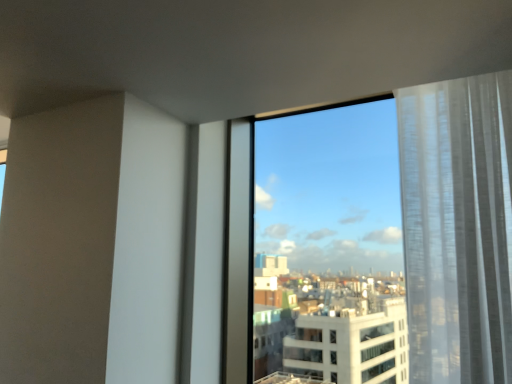
Question: From a real-world perspective, is white sheer curtain at right positioned above or below transparent glass window at center?

Choices:
 (A) above
 (B) below

Answer: (A)

Question: In terms of size, does white sheer curtain at right appear bigger or smaller than transparent glass window at center?

Choices:
 (A) small
 (B) big

Answer: (A)

Question: Is white sheer curtain at right in front of or behind transparent glass window at center in the image?

Choices:
 (A) behind
 (B) front

Answer: (B)

Question: Does point (488, 349) appear closer or farther from the camera than point (414, 134)?

Choices:
 (A) closer
 (B) farther

Answer: (A)

Question: From the image's perspective, is transparent glass window at center positioned above or below white sheer curtain at right?

Choices:
 (A) below
 (B) above

Answer: (A)

Question: In terms of height, does transparent glass window at center look taller or shorter compared to white sheer curtain at right?

Choices:
 (A) tall
 (B) short

Answer: (A)

Question: Is transparent glass window at center wider or thinner than white sheer curtain at right?

Choices:
 (A) thin
 (B) wide

Answer: (A)